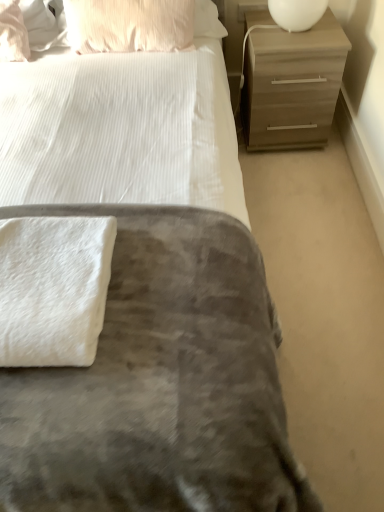
Question: Is pink textured pillow at upper left, the 2th pillow when ordered from left to right, positioned beyond the bounds of matte pink pillow at upper left, the 2th pillow positioned from the right?

Choices:
 (A) no
 (B) yes

Answer: (B)

Question: From the image's perspective, is pink textured pillow at upper left, the first pillow in the right-to-left sequence, located beneath matte pink pillow at upper left, acting as the first pillow starting from the left?

Choices:
 (A) no
 (B) yes

Answer: (A)

Question: Considering the relative positions of pink textured pillow at upper left, the first pillow in the right-to-left sequence, and matte pink pillow at upper left, the 2th pillow positioned from the right, in the image provided, is pink textured pillow at upper left, the first pillow in the right-to-left sequence, to the right of matte pink pillow at upper left, the 2th pillow positioned from the right, from the viewer's perspective?

Choices:
 (A) no
 (B) yes

Answer: (B)

Question: Does pink textured pillow at upper left, the 2th pillow when ordered from left to right, have a lesser width compared to matte pink pillow at upper left, the 2th pillow positioned from the right?

Choices:
 (A) yes
 (B) no

Answer: (A)

Question: Is pink textured pillow at upper left, the first pillow in the right-to-left sequence, taller than matte pink pillow at upper left, the 2th pillow positioned from the right?

Choices:
 (A) yes
 (B) no

Answer: (A)

Question: Does pink textured pillow at upper left, the 2th pillow when ordered from left to right, have a lesser height compared to matte pink pillow at upper left, the 2th pillow positioned from the right?

Choices:
 (A) yes
 (B) no

Answer: (B)

Question: Is white glossy lampshade at upper right to the left of pink textured pillow at upper left, the 2th pillow when ordered from left to right, from the viewer's perspective?

Choices:
 (A) yes
 (B) no

Answer: (B)

Question: Could pink textured pillow at upper left, the first pillow in the right-to-left sequence, be considered to be inside white glossy lampshade at upper right?

Choices:
 (A) no
 (B) yes

Answer: (A)

Question: From a real-world perspective, is white glossy lampshade at upper right physically above pink textured pillow at upper left, the first pillow in the right-to-left sequence?

Choices:
 (A) yes
 (B) no

Answer: (B)

Question: Does white glossy lampshade at upper right have a greater width compared to pink textured pillow at upper left, the first pillow in the right-to-left sequence?

Choices:
 (A) no
 (B) yes

Answer: (B)

Question: Does white glossy lampshade at upper right have a smaller size compared to pink textured pillow at upper left, the 2th pillow when ordered from left to right?

Choices:
 (A) yes
 (B) no

Answer: (A)

Question: Is white glossy lampshade at upper right located outside pink textured pillow at upper left, the 2th pillow when ordered from left to right?

Choices:
 (A) no
 (B) yes

Answer: (B)

Question: Can you confirm if matte brown chest of drawers at upper right is smaller than white glossy lampshade at upper right?

Choices:
 (A) yes
 (B) no

Answer: (B)